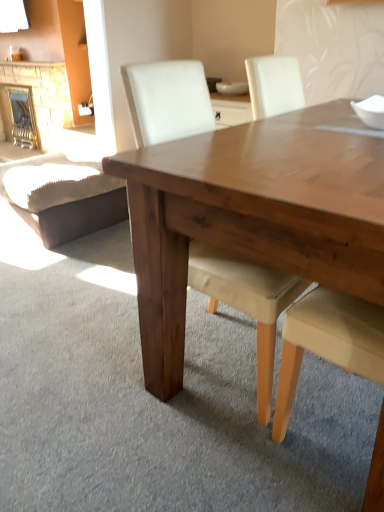
The width and height of the screenshot is (384, 512). What are the coordinates of `brown leather swivel chair at lower left` in the screenshot? It's located at coord(63,196).

Find the location of a particular element. The height and width of the screenshot is (512, 384). white glossy bowl at upper right, the second bowl when ordered from left to right is located at coordinates (370, 111).

Image resolution: width=384 pixels, height=512 pixels. Describe the element at coordinates (232, 88) in the screenshot. I see `white glossy bowl at center, which is the 1th bowl in top-to-bottom order` at that location.

Measure the distance between point [223,93] and camera.

They are 2.92 meters apart.

Identify the location of matte white chair at center. (247, 303).

Is brown leather swivel chair at lower left far away from brick fireplace at left, which appears as the 2th fireplace when viewed from the left?

brown leather swivel chair at lower left is far away from brick fireplace at left, which appears as the 2th fireplace when viewed from the left.

Could you tell me if brown leather swivel chair at lower left is facing brick fireplace at left, the 1th fireplace from the right?

No, brown leather swivel chair at lower left is not oriented towards brick fireplace at left, the 1th fireplace from the right.

Can you tell me how much brown leather swivel chair at lower left and brick fireplace at left, which appears as the 2th fireplace when viewed from the left, differ in facing direction?

1.34 degrees.

Consider the image. What's the angular difference between brick fireplace at left, the 1th fireplace from the right, and brick fireplace at left, the second fireplace when ordered from right to left,'s facing directions?

0.00337 degrees separate the facing orientations of brick fireplace at left, the 1th fireplace from the right, and brick fireplace at left, the second fireplace when ordered from right to left.

Would you say brick fireplace at left, the 1th fireplace from the right, contains brick fireplace at left, the second fireplace when ordered from right to left?

Actually, brick fireplace at left, the second fireplace when ordered from right to left, is outside brick fireplace at left, the 1th fireplace from the right.

Does brick fireplace at left, which appears as the 2th fireplace when viewed from the left, have a smaller size compared to brick fireplace at left, placed as the 1th fireplace when sorted from left to right?

Yes.

Is brick fireplace at left, which appears as the 2th fireplace when viewed from the left, with brick fireplace at left, the second fireplace when ordered from right to left?

No, brick fireplace at left, which appears as the 2th fireplace when viewed from the left, is not with brick fireplace at left, the second fireplace when ordered from right to left.

Is brown leather swivel chair at lower left in front of or behind matte white chair at center in the image?

brown leather swivel chair at lower left is behind matte white chair at center.

Does brown leather swivel chair at lower left appear on the right side of matte white chair at center?

No.

Is brown leather swivel chair at lower left placed right next to matte white chair at center?

brown leather swivel chair at lower left and matte white chair at center are not in contact.

Could you tell me if brown leather swivel chair at lower left is turned towards matte white chair at center?

No, brown leather swivel chair at lower left does not turn towards matte white chair at center.

Can you confirm if brown leather swivel chair at lower left is shorter than white glossy bowl at upper right, the second bowl when ordered from left to right?

Incorrect, the height of brown leather swivel chair at lower left does not fall short of that of white glossy bowl at upper right, the second bowl when ordered from left to right.

Does brown leather swivel chair at lower left turn towards white glossy bowl at upper right, the first bowl in the bottom-to-top sequence?

No, brown leather swivel chair at lower left is not turned towards white glossy bowl at upper right, the first bowl in the bottom-to-top sequence.

What's the angular difference between brown leather swivel chair at lower left and white glossy bowl at upper right, acting as the second bowl starting from the back,'s facing directions?

1.26 degrees.

Considering the relative sizes of brick fireplace at left, the second fireplace when ordered from right to left, and white glossy bowl at upper right, which is counted as the first bowl, starting from the right, in the image provided, is brick fireplace at left, the second fireplace when ordered from right to left, wider than white glossy bowl at upper right, which is counted as the first bowl, starting from the right,?

Correct, the width of brick fireplace at left, the second fireplace when ordered from right to left, exceeds that of white glossy bowl at upper right, which is counted as the first bowl, starting from the right.

Which point is more forward, (9,114) or (364,100)?

The point (364,100) is in front.

From a real-world perspective, which object stands above the other?

white glossy bowl at upper right, acting as the second bowl starting from the back, from a real-world perspective.

Is brick fireplace at left, the 1th fireplace from the right, positioned with its back to brown leather swivel chair at lower left?

No, brick fireplace at left, the 1th fireplace from the right,'s orientation is not away from brown leather swivel chair at lower left.

Considering the positions of objects brick fireplace at left, the 1th fireplace from the right, and brown leather swivel chair at lower left in the image provided, who is behind, brick fireplace at left, the 1th fireplace from the right, or brown leather swivel chair at lower left?

brick fireplace at left, the 1th fireplace from the right, is further from the camera.

From a real-world perspective, which is physically below, brick fireplace at left, which appears as the 2th fireplace when viewed from the left, or brown leather swivel chair at lower left?

In real-world perspective, brown leather swivel chair at lower left is lower.

You are a GUI agent. You are given a task and a screenshot of the screen. Output one action in this format:
    pyautogui.click(x=<x>, y=<y>)
    Task: Click on the fireplace that is the 1st one when counting upward from the brown leather swivel chair at lower left (from the image's perspective)
    This screenshot has height=512, width=384.
    Given the screenshot: What is the action you would take?
    pyautogui.click(x=22, y=116)

Considering the positions of objects white glossy bowl at upper right, acting as the second bowl starting from the back, and brick fireplace at left, placed as the 1th fireplace when sorted from left to right, in the image provided, who is in front, white glossy bowl at upper right, acting as the second bowl starting from the back, or brick fireplace at left, placed as the 1th fireplace when sorted from left to right,?

white glossy bowl at upper right, acting as the second bowl starting from the back.

From the image's perspective, is white glossy bowl at upper right, the second bowl when ordered from left to right, on brick fireplace at left, the second fireplace when ordered from right to left?

No, from the image's perspective, white glossy bowl at upper right, the second bowl when ordered from left to right, is not over brick fireplace at left, the second fireplace when ordered from right to left.

In terms of height, does white glossy bowl at upper right, which is counted as the first bowl, starting from the right, look taller or shorter compared to brick fireplace at left, the second fireplace when ordered from right to left?

In the image, white glossy bowl at upper right, which is counted as the first bowl, starting from the right, appears to be shorter than brick fireplace at left, the second fireplace when ordered from right to left.

Is white glossy bowl at upper right, which ranks as the 1th bowl in front-to-back order, thinner than brick fireplace at left, placed as the 1th fireplace when sorted from left to right?

Yes, white glossy bowl at upper right, which ranks as the 1th bowl in front-to-back order, is thinner than brick fireplace at left, placed as the 1th fireplace when sorted from left to right.

Starting from the brown leather swivel chair at lower left, which fireplace is the 1st one to the left? Please provide its 2D coordinates.

[(22, 116)]

At what (x,y) coordinates should I click in order to perform the action: click on fireplace above the brick fireplace at left, which appears as the 2th fireplace when viewed from the left (from the image's perspective). Please return your answer as a coordinate pair (x, y). The height and width of the screenshot is (512, 384). Looking at the image, I should click on (39, 98).

When comparing their distances from matte white chair at center, does brick fireplace at left, the 1th fireplace from the right, or brown leather swivel chair at lower left seem further?

The object further to matte white chair at center is brick fireplace at left, the 1th fireplace from the right.

Which object lies further to the anchor point brick fireplace at left, the 1th fireplace from the right, brown leather swivel chair at lower left or white glossy bowl at center, the second bowl positioned from the front?

white glossy bowl at center, the second bowl positioned from the front, lies further to brick fireplace at left, the 1th fireplace from the right, than the other object.

When comparing their distances from brick fireplace at left, the 1th fireplace from the right, does white glossy bowl at center, the second bowl ordered from the bottom, or white glossy bowl at upper right, which is counted as the first bowl, starting from the right, seem further?

white glossy bowl at upper right, which is counted as the first bowl, starting from the right, is further to brick fireplace at left, the 1th fireplace from the right.

Considering their positions, is matte white chair at center positioned closer to white glossy bowl at center, marked as the 1th bowl in a left-to-right arrangement, than brown leather swivel chair at lower left?

Based on the image, brown leather swivel chair at lower left appears to be nearer to white glossy bowl at center, marked as the 1th bowl in a left-to-right arrangement.

Which object lies nearer to the anchor point white glossy bowl at center, the second bowl ordered from the bottom, brick fireplace at left, the second fireplace when ordered from right to left, or brick fireplace at left, which appears as the 2th fireplace when viewed from the left?

Among the two, brick fireplace at left, the second fireplace when ordered from right to left, is located nearer to white glossy bowl at center, the second bowl ordered from the bottom.

Which object lies further to the anchor point brown leather swivel chair at lower left, white glossy bowl at center, marked as the 1th bowl in a left-to-right arrangement, or brick fireplace at left, which appears as the 2th fireplace when viewed from the left?

Among the two, brick fireplace at left, which appears as the 2th fireplace when viewed from the left, is located further to brown leather swivel chair at lower left.

Estimate the real-world distances between objects in this image. Which object is further from brown leather swivel chair at lower left, brick fireplace at left, which appears as the 2th fireplace when viewed from the left, or white glossy bowl at center, marked as the 1th bowl in a left-to-right arrangement?

Based on the image, brick fireplace at left, which appears as the 2th fireplace when viewed from the left, appears to be further to brown leather swivel chair at lower left.

When comparing their distances from brick fireplace at left, which appears as the 2th fireplace when viewed from the left, does brown leather swivel chair at lower left or matte white chair at center seem further?

matte white chair at center is further to brick fireplace at left, which appears as the 2th fireplace when viewed from the left.

The width and height of the screenshot is (384, 512). I want to click on swivel chair between white glossy bowl at upper right, which ranks as the 1th bowl in front-to-back order, and brick fireplace at left, placed as the 1th fireplace when sorted from left to right, in the front-back direction, so click(63, 196).

What are the coordinates of `fireplace between brick fireplace at left, placed as the 1th fireplace when sorted from left to right, and white glossy bowl at center, which is the 1th bowl in top-to-bottom order, in the horizontal direction` in the screenshot? It's located at (22, 116).

Where is `fireplace between brown leather swivel chair at lower left and brick fireplace at left, the 1th fireplace from the right, in the front-back direction`? fireplace between brown leather swivel chair at lower left and brick fireplace at left, the 1th fireplace from the right, in the front-back direction is located at coordinates (39, 98).

Find the location of a particular element. This screenshot has height=512, width=384. swivel chair between brick fireplace at left, the second fireplace when ordered from right to left, and white glossy bowl at center, marked as the 1th bowl in a left-to-right arrangement is located at coordinates (63, 196).